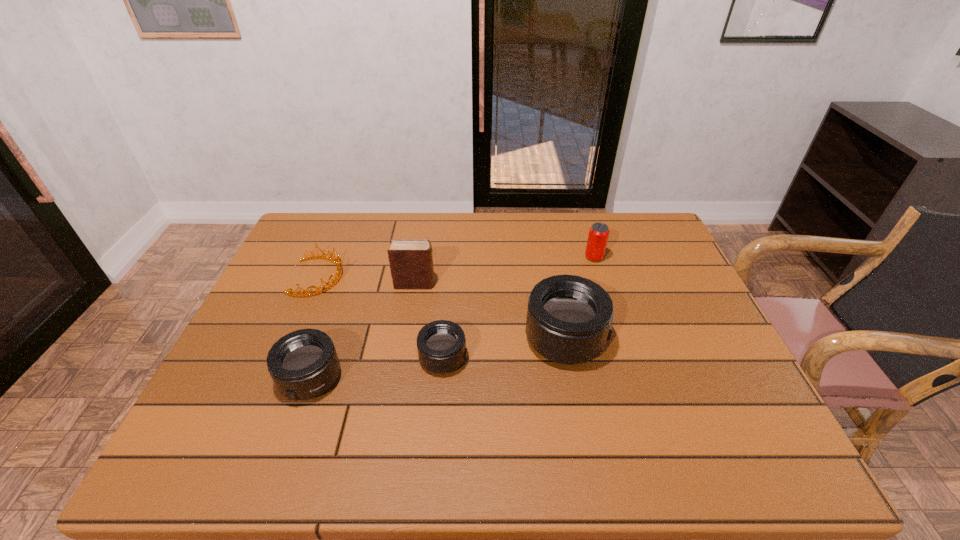
Given the evenly spaced telephoto lenss in the image, where should an extra telephoto lens be added on the right to preserve the spacing? Please point to a vacant space. Please provide its 2D coordinates. Your answer should be formatted as a tuple, i.e. [(x, y)], where the tuple contains the x and y coordinates of a point satisfying the conditions above.

[(678, 321)]